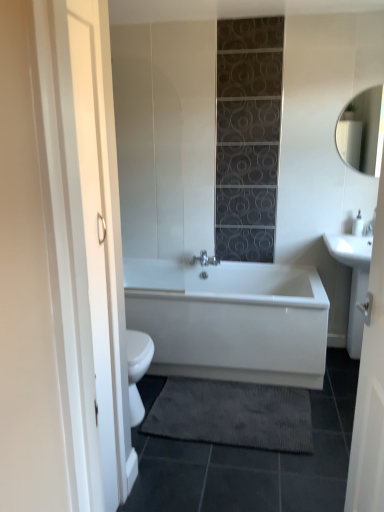
Locate an element on the screen. free space above dark gray textured bath mat at lower center (from a real-world perspective) is located at coordinates (236, 411).